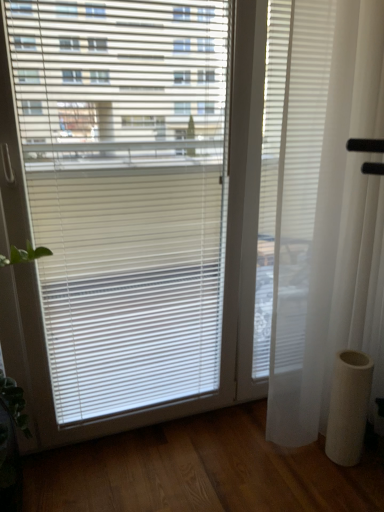
Locate an element on the screen. This screenshot has width=384, height=512. free location in front of white matte cylinder at lower right is located at coordinates (349, 486).